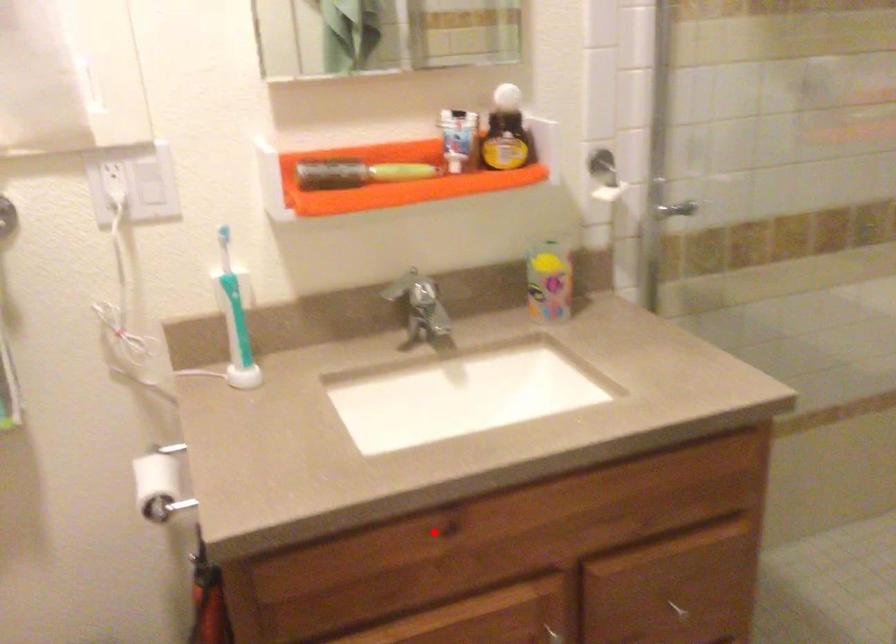
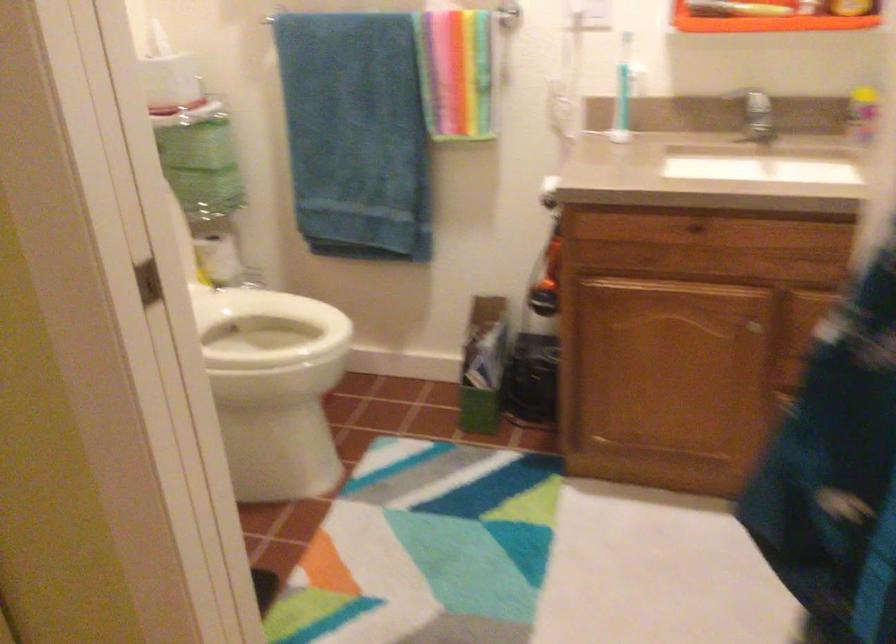
Question: I am providing you with two images of the same scene from different viewpoints. Image1 has a red point marked. In image2, the corresponding 3D location appears at what relative position? Reply with the corresponding letter.

Choices:
 (A) Closer
 (B) Farther

Answer: (B)